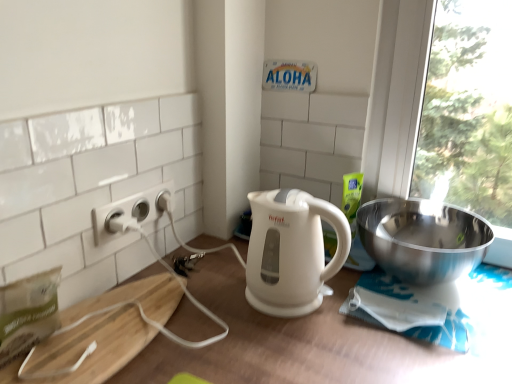
Question: Would you say white glossy electric kettle at center is to the left or to the right of white plastic power outlet at left in the picture?

Choices:
 (A) right
 (B) left

Answer: (A)

Question: From a real-world perspective, relative to white plastic power outlet at left, is white glossy electric kettle at center vertically above or below?

Choices:
 (A) below
 (B) above

Answer: (A)

Question: Based on their relative distances, which object is farther from the white glossy electric kettle at center?

Choices:
 (A) white matte table at center
 (B) white plastic power outlet at left
 (C) polished stainless steel bowl at right

Answer: (B)

Question: Considering the real-world distances, which object is farthest from the white matte table at center?

Choices:
 (A) polished stainless steel bowl at right
 (B) white glossy electric kettle at center
 (C) white plastic power outlet at left

Answer: (C)